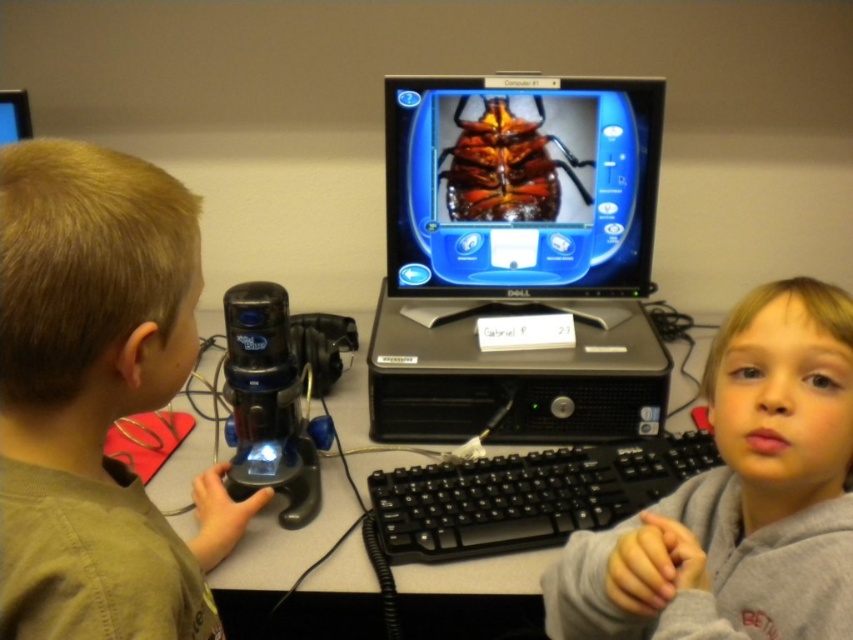
You are a teacher in the classroom. You need to hand out a worksheet to the child wearing the gray fleece sweatshirt at center right. The worksheet is currently on the black plastic keyboard at center. Can you reach the worksheet without moving the keyboard?

The gray fleece sweatshirt at center right is to the right of the black plastic keyboard at center, so you can reach the worksheet on the black plastic keyboard at center without moving it by extending your hand to the left from the sweatshirt.

You are a teacher observing the scene. You need to retrieve a pen from the desk without disturbing the children. Since the gray fleece sweatshirt at center right is in front of the black plastic computer desk at center, can you access the desk behind it?

The gray fleece sweatshirt at center right is in front of the black plastic computer desk at center, so you cannot directly access the desk behind it without moving the sweatshirt or going around it.